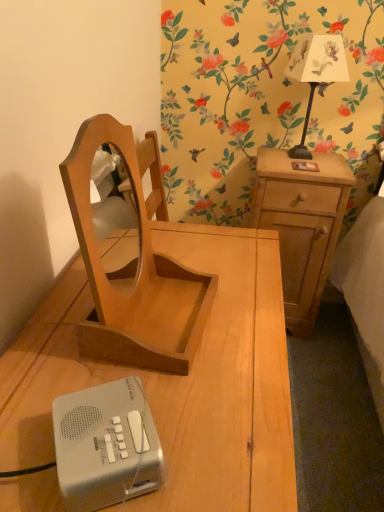
In order to click on free spot in front of light brown wood mirror at center in this screenshot , I will do `click(156, 408)`.